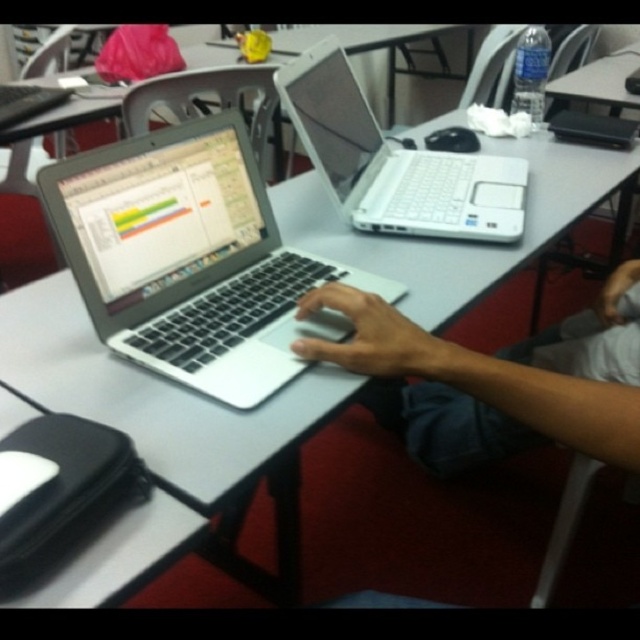
You are a student in the classroom and want to reach for the black rubberized mouse at lower left without moving your chair. Can you do so comfortably if the silver metallic laptop at center is in your way?

The silver metallic laptop at center is to the right of the black rubberized mouse at lower left, so the laptop is positioned to the right of the mouse. This means the mouse is on the left side relative to the laptop. If you are seated at the desk, the mouse being on the lower left might be within reach without moving your chair, but the laptop being to the right of the mouse might not block direct access. However, since the mouse is at lower left and the laptop is centered, the laptop could be between you,

You are a student who needs to reach a point in the classroom at coordinates point (422, 188). If your maximum reach is 3.5 feet, can you reach that point without moving your chair?

The distance of point (422, 188) from camera is 3.70 feet, which is beyond your maximum reach of 3.5 feet. You cannot reach that point without moving your chair.

You are a student who needs to reach the silver metallic laptop at center from your current position. The classroom has a rule that you must stay at least 2 feet away from others. Can you safely reach it without violating the rule?

The silver metallic laptop at center is 25.82 inches away from camera. Since 25.82 inches is approximately 2.15 feet, which is slightly more than the 2 feet minimum distance required, you can safely reach it without violating the rule.